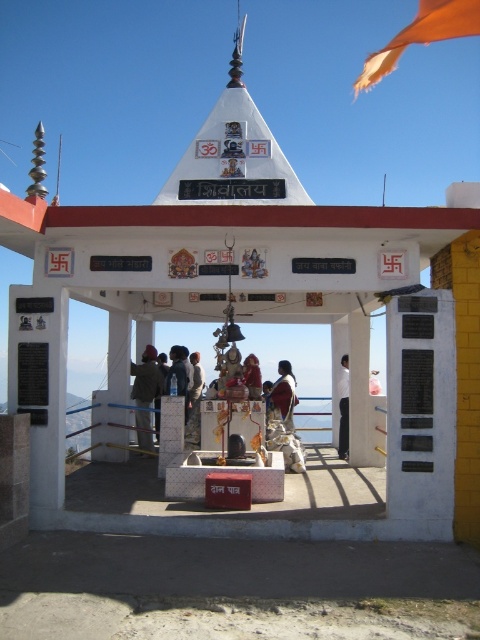
Question: Does orange fabric flag at upper right come behind white fabric at center?

Choices:
 (A) no
 (B) yes

Answer: (B)

Question: Can you confirm if brown fabric saree at center is positioned to the right of matte gold statue at center?

Choices:
 (A) yes
 (B) no

Answer: (A)

Question: Among these objects, which one is farthest from the camera?

Choices:
 (A) white fabric at center
 (B) orange fabric flag at upper right
 (C) dark brown jacket at center

Answer: (B)

Question: Which point is farther to the camera?

Choices:
 (A) (454, 16)
 (B) (348, 420)
 (C) (147, 365)
 (D) (274, 387)

Answer: (A)

Question: Can you confirm if white fabric at center is thinner than matte gold statue at center?

Choices:
 (A) no
 (B) yes

Answer: (B)

Question: Among these points, which one is farthest from the camera?

Choices:
 (A) (344, 433)
 (B) (445, 26)

Answer: (B)